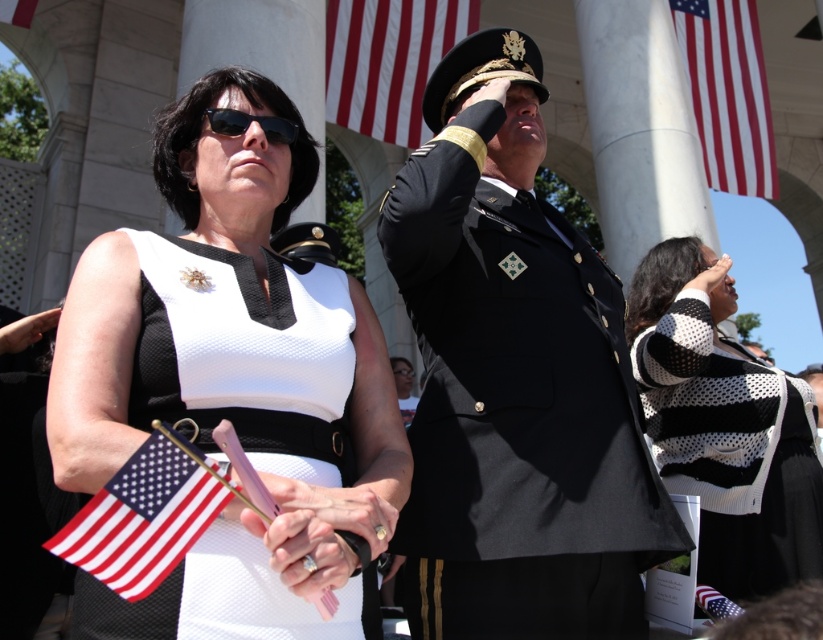
You are a photographer at the event and need to frame a photo that includes both the black and white knitted sweater at center and the black matte sunglasses at upper left. Which object should you adjust your camera to focus on first to ensure both fit in the frame, considering their sizes?

The black and white knitted sweater at center has a larger width than the black matte sunglasses at upper left, so you should focus on the black and white knitted sweater at center first to ensure both objects fit in the frame.

You are attending this event and want to take a photo of both the matte fabric flag at lower left and the matte black uniform at center. Which object should you focus on first to ensure both are in focus?

You should focus on the matte fabric flag at lower left first because it is closer to you than the matte black uniform at center, so adjusting focus from near to far will help both be in focus.